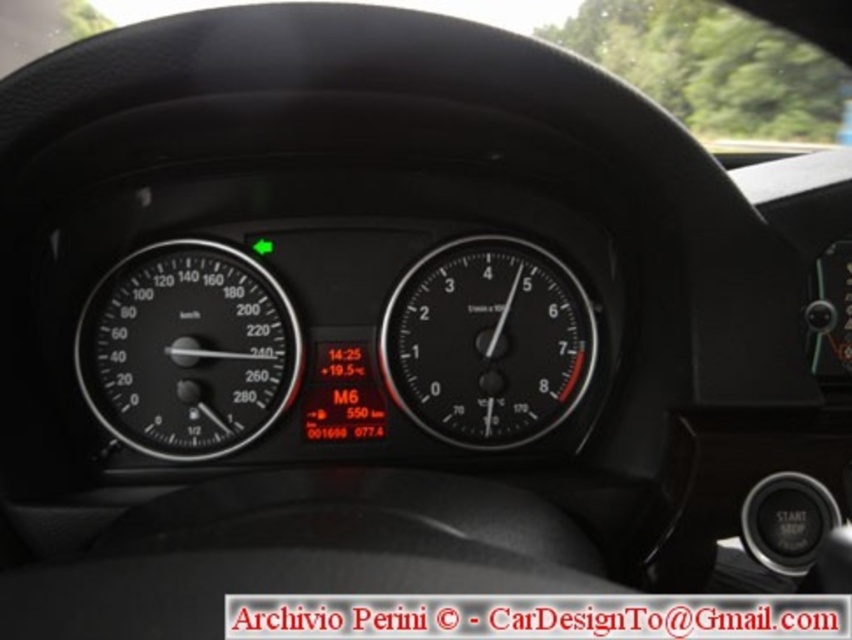
You are a driver sitting in the car and want to check the distance between the black matte speedometer at left and the camera. Can you estimate if it is more than 1 meter?

The distance between the black matte speedometer at left and the camera is 1.37 meters, which is more than 1 meter.

You are a mechanic working on a car and need to install a new sensor between the black matte speedometer at left and the black matte speedometer at center. The sensor requires 16 inches of space to fit. Based on the dashboard layout, will the sensor fit?

The black matte speedometer at left is 15.31 inches away from the black matte speedometer at center, so the sensor requiring 16 inches of space will not fit between them.

You are driving a car and want to check your speed. You notice the black matte speedometer at center and the transparent glass windshield at upper center. Which object is taller?

The black matte speedometer at center is taller than the transparent glass windshield at upper center.